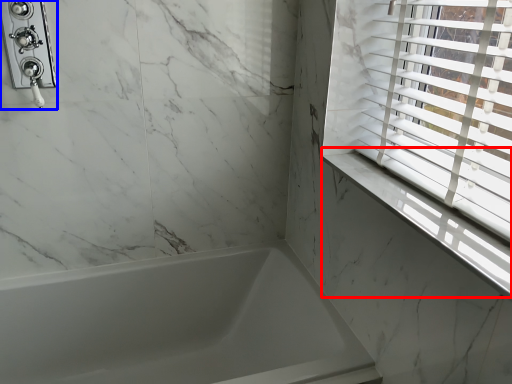
Question: Which object appears closest to the camera in this image, window sill (highlighted by a red box) or shower (highlighted by a blue box)?

Choices:
 (A) window sill
 (B) shower

Answer: (A)